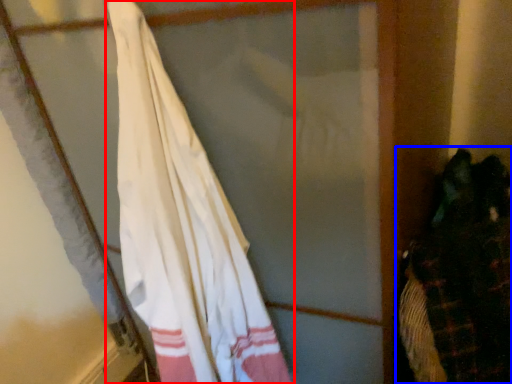
Question: Among these objects, which one is farthest to the camera, curtain (highlighted by a red box) or laundry (highlighted by a blue box)?

Choices:
 (A) curtain
 (B) laundry

Answer: (B)